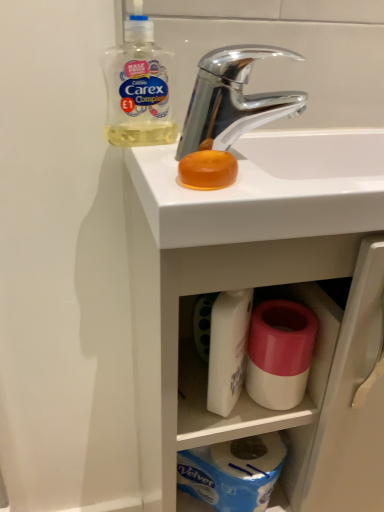
Question: From a real-world perspective, is pink matte toilet paper at lower center over chrome metallic faucet at upper center?

Choices:
 (A) no
 (B) yes

Answer: (A)

Question: Considering the relative sizes of pink matte toilet paper at lower center and chrome metallic faucet at upper center in the image provided, is pink matte toilet paper at lower center shorter than chrome metallic faucet at upper center?

Choices:
 (A) yes
 (B) no

Answer: (B)

Question: From the image's perspective, is pink matte toilet paper at lower center on top of chrome metallic faucet at upper center?

Choices:
 (A) yes
 (B) no

Answer: (B)

Question: Is pink matte toilet paper at lower center to the right of chrome metallic faucet at upper center from the viewer's perspective?

Choices:
 (A) no
 (B) yes

Answer: (B)

Question: Is pink matte toilet paper at lower center smaller than chrome metallic faucet at upper center?

Choices:
 (A) yes
 (B) no

Answer: (A)

Question: Does point (317, 315) appear closer or farther from the camera than point (364, 181)?

Choices:
 (A) closer
 (B) farther

Answer: (B)

Question: From their relative heights in the image, would you say white plastic container at center is taller or shorter than white glossy sink at upper center?

Choices:
 (A) short
 (B) tall

Answer: (A)

Question: From a real-world perspective, is white plastic container at center physically located above or below white glossy sink at upper center?

Choices:
 (A) below
 (B) above

Answer: (B)

Question: Considering their positions, is white plastic container at center located in front of or behind white glossy sink at upper center?

Choices:
 (A) behind
 (B) front

Answer: (A)

Question: Considering the positions of white glossy sink at upper center and white plastic container at center in the image, is white glossy sink at upper center bigger or smaller than white plastic container at center?

Choices:
 (A) big
 (B) small

Answer: (A)

Question: Is white glossy sink at upper center wider or thinner than white plastic container at center?

Choices:
 (A) wide
 (B) thin

Answer: (A)

Question: Is white glossy sink at upper center in front of or behind white plastic container at center in the image?

Choices:
 (A) behind
 (B) front

Answer: (B)

Question: From a real-world perspective, is white glossy sink at upper center physically located above or below white plastic container at center?

Choices:
 (A) above
 (B) below

Answer: (B)

Question: From a real-world perspective, is translucent plastic bottle at upper left above or below pink matte toilet paper at lower center?

Choices:
 (A) above
 (B) below

Answer: (A)

Question: From the image's perspective, is translucent plastic bottle at upper left above or below pink matte toilet paper at lower center?

Choices:
 (A) above
 (B) below

Answer: (A)